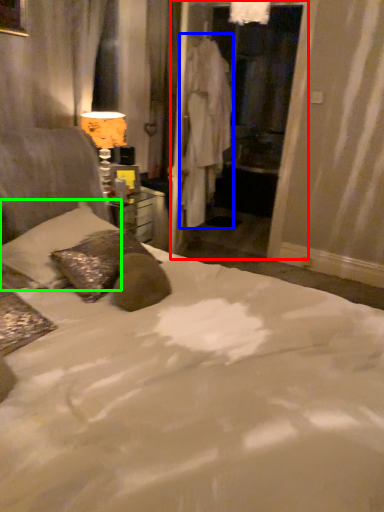
Question: Which object is the farthest from screen door (highlighted by a red box)? Choose among these: robe (highlighted by a blue box) or pillow (highlighted by a green box).

Choices:
 (A) robe
 (B) pillow

Answer: (B)